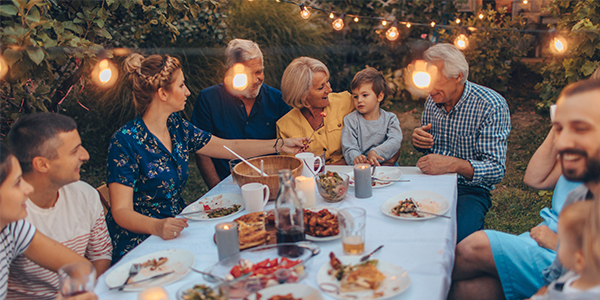
Find the location of a particular element. cups is located at coordinates (352, 238), (288, 228), (313, 154), (256, 195).